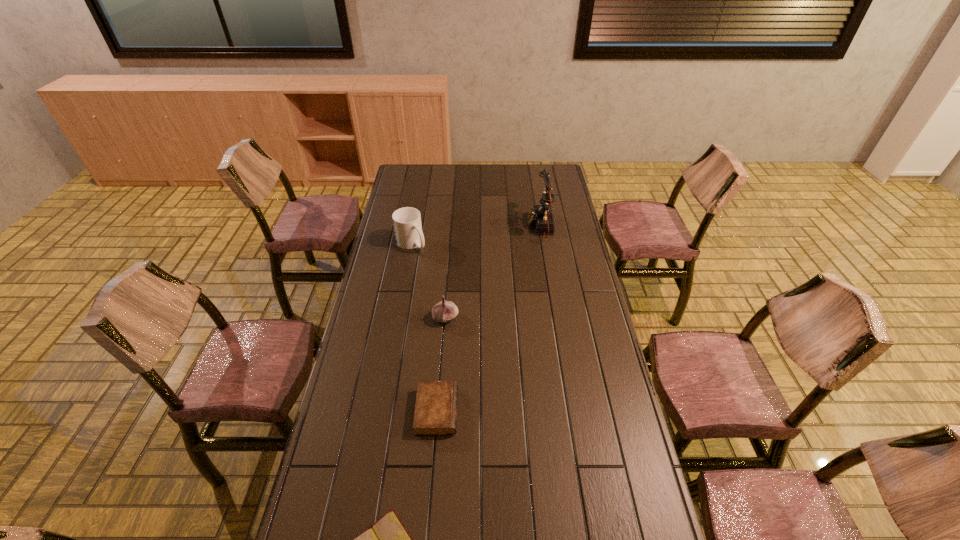
Where is `free space between the third nearest object and the second tallest object`? Image resolution: width=960 pixels, height=540 pixels. free space between the third nearest object and the second tallest object is located at coordinates (428, 281).

You are a GUI agent. You are given a task and a screenshot of the screen. Output one action in this format:
    pyautogui.click(x=<x>, y=<y>)
    Task: Click on the vacant area that lies between the tallest object and the third farthest object
    
    Given the screenshot: What is the action you would take?
    pyautogui.click(x=492, y=272)

Find the location of a particular element. free spot between the garlic and the second tallest object is located at coordinates (428, 281).

Locate an element on the screen. Image resolution: width=960 pixels, height=540 pixels. object that ranks as the fourth closest to the taller diary is located at coordinates (541, 216).

Identify which object is located as the nearest to the fourth shortest object. Please provide its 2D coordinates. Your answer should be formatted as a tuple, i.e. [(x, y)], where the tuple contains the x and y coordinates of a point satisfying the conditions above.

[(443, 311)]

Find the location of a particular element. Image resolution: width=960 pixels, height=540 pixels. vacant space that satisfies the following two spatial constraints: 1. on the dial of the rightmost object; 2. on the front side of the second tallest object is located at coordinates (543, 244).

Locate an element on the screen. free location that satisfies the following two spatial constraints: 1. on the dial of the rightmost object; 2. on the front side of the third tallest object is located at coordinates (556, 318).